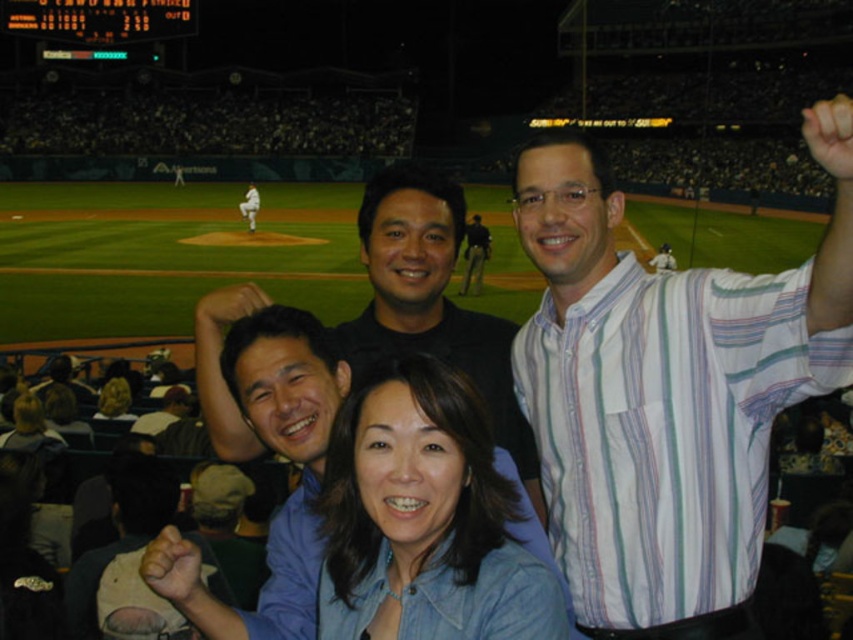
Does white striped shirt at upper right come behind dark blue uniform at center?

No, it is in front of dark blue uniform at center.

Does white striped shirt at upper right have a lesser width compared to dark blue uniform at center?

In fact, white striped shirt at upper right might be wider than dark blue uniform at center.

Identify the location of white striped shirt at upper right. (666, 392).

Identify the location of white striped shirt at upper right. (666, 392).

Looking at this image, between black matte shirt at center and white uniform at center, which one has more height?

black matte shirt at center

Between point (238, 298) and point (259, 196), which one is positioned in front?

Positioned in front is point (238, 298).

Which is behind, point (225, 422) or point (248, 196)?

The point (248, 196) is behind.

This screenshot has width=853, height=640. What are the coordinates of `black matte shirt at center` in the screenshot? It's located at (432, 300).

Is dark blue uniform at center to the left of smooth brown hair at lower center from the viewer's perspective?

No, dark blue uniform at center is not to the left of smooth brown hair at lower center.

Between dark blue uniform at center and smooth brown hair at lower center, which one is positioned higher?

Positioned higher is dark blue uniform at center.

Is point (465, 266) behind point (108, 406)?

Yes, point (465, 266) is behind point (108, 406).

Find the location of a particular element. The width and height of the screenshot is (853, 640). dark blue uniform at center is located at coordinates (474, 253).